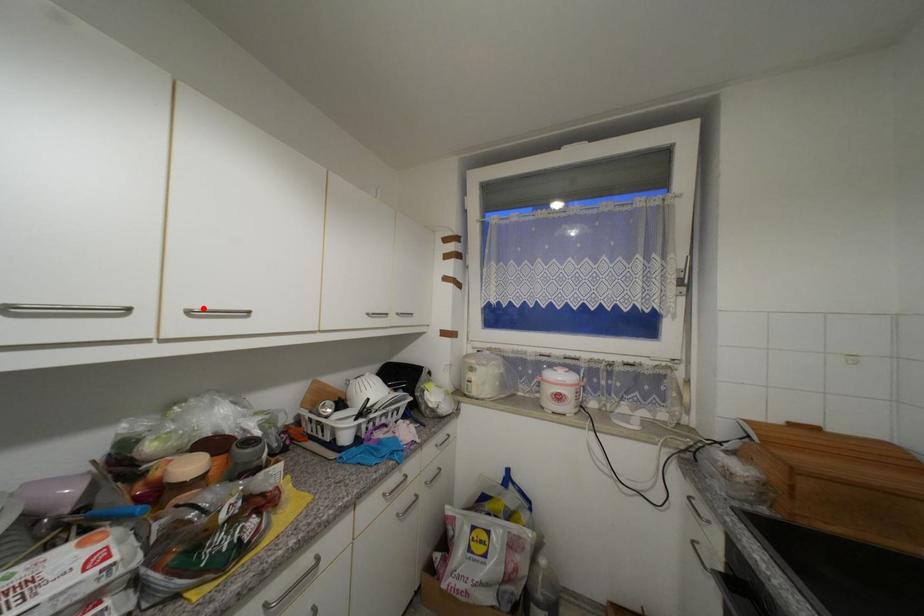
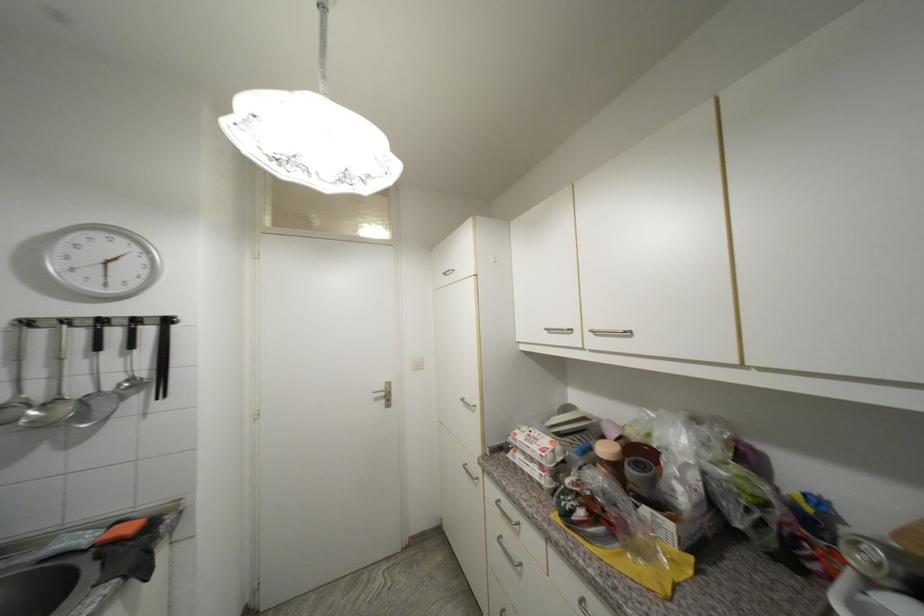
Where in the second image is the point corresponding to the highlighted location from the first image?

(601, 330)